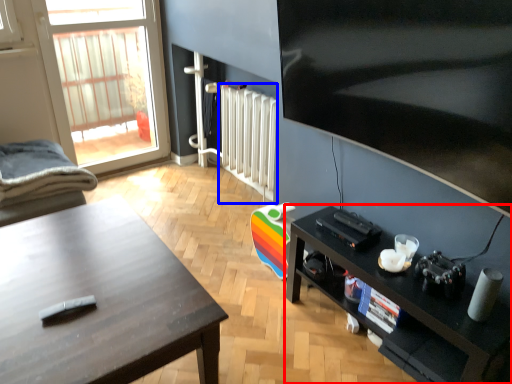
Question: Which object is closer to the camera taking this photo, shelf (highlighted by a red box) or radiator (highlighted by a blue box)?

Choices:
 (A) shelf
 (B) radiator

Answer: (A)